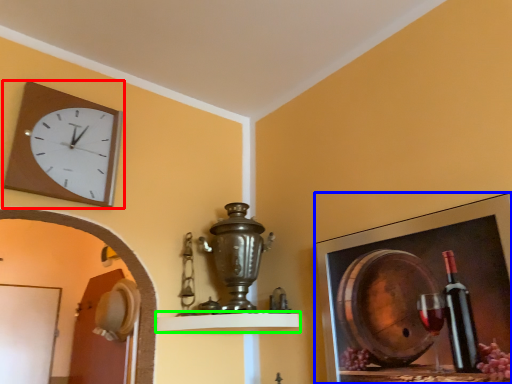
Question: Which object is the closest to the wall clock (highlighted by a red box)? Choose among these: picture frame (highlighted by a blue box) or shelf (highlighted by a green box).

Choices:
 (A) picture frame
 (B) shelf

Answer: (B)